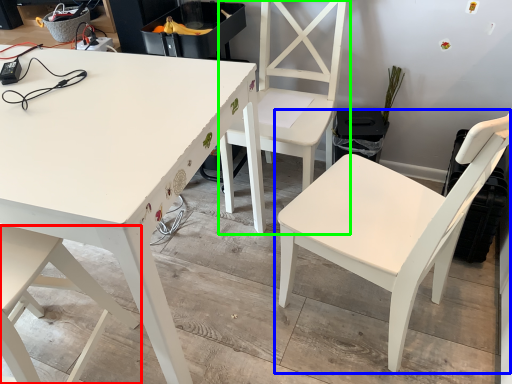
Question: Estimate the real-world distances between objects in this image. Which object is closer to chair (highlighted by a red box), chair (highlighted by a blue box) or chair (highlighted by a green box)?

Choices:
 (A) chair
 (B) chair

Answer: (A)